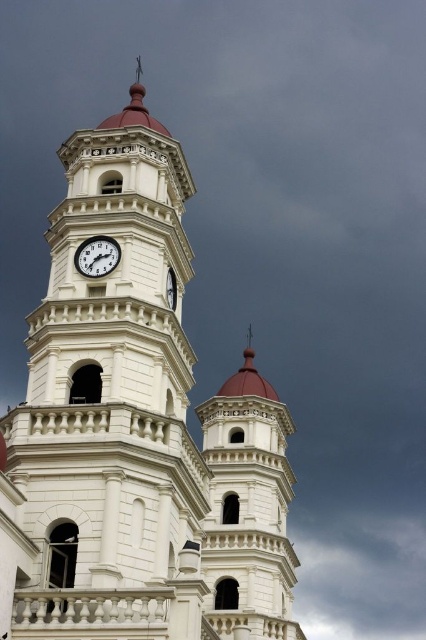
You are standing 200 meters away from a clock tower. A point on the tower is marked at coordinates point (409, 564). Can you determine if this point is closer to you than your current position?

The distance of point (409, 564) from camera is 248.64 meters, so the point is farther away from you than your current position of 200 meters.

You are a drone operator planning to fly a drone from the cloudy sky at upper center to the white glossy clock at center. The drone has a maximum flight range of 200 meters. Can the drone successfully reach the clock?

The cloudy sky at upper center and white glossy clock at center are 196.15 meters apart from each other. Since the distance is less than the drone maximum flight range of 200 meters, the drone can successfully reach the clock.